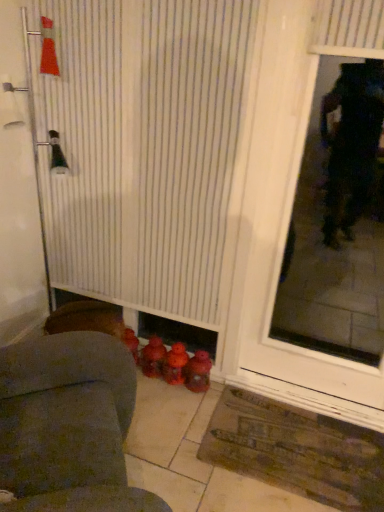
Question: Is transparent glass door at right closer to camera compared to rubberized red toy at lower center, which appears as the 3th toy when viewed from the left?

Choices:
 (A) yes
 (B) no

Answer: (A)

Question: Considering the relative sizes of transparent glass door at right and rubberized red toy at lower center, which appears as the 3th toy when viewed from the left, in the image provided, is transparent glass door at right smaller than rubberized red toy at lower center, which appears as the 3th toy when viewed from the left,?

Choices:
 (A) no
 (B) yes

Answer: (A)

Question: Is transparent glass door at right not inside rubberized red toy at lower center, the first toy positioned from the right?

Choices:
 (A) yes
 (B) no

Answer: (A)

Question: From a real-world perspective, is transparent glass door at right under rubberized red toy at lower center, the first toy positioned from the right?

Choices:
 (A) no
 (B) yes

Answer: (A)

Question: Would you consider transparent glass door at right to be distant from rubberized red toy at lower center, which appears as the 3th toy when viewed from the left?

Choices:
 (A) yes
 (B) no

Answer: (A)

Question: Is the depth of transparent glass door at right greater than that of rubberized red toy at lower center, the first toy positioned from the right?

Choices:
 (A) no
 (B) yes

Answer: (A)

Question: Does white textured door at left have a lesser width compared to brown textured mat at lower right?

Choices:
 (A) yes
 (B) no

Answer: (A)

Question: Considering the relative positions of white textured door at left and brown textured mat at lower right in the image provided, is white textured door at left behind brown textured mat at lower right?

Choices:
 (A) yes
 (B) no

Answer: (B)

Question: Is brown textured mat at lower right located within white textured door at left?

Choices:
 (A) yes
 (B) no

Answer: (B)

Question: Is white textured door at left taller than brown textured mat at lower right?

Choices:
 (A) yes
 (B) no

Answer: (A)

Question: From a real-world perspective, is white textured door at left beneath brown textured mat at lower right?

Choices:
 (A) no
 (B) yes

Answer: (A)

Question: From the image's perspective, is white textured door at left located above brown textured mat at lower right?

Choices:
 (A) yes
 (B) no

Answer: (A)

Question: Is rubberized plastic toy at lower center, the 2th toy when ordered from left to right, not near rubberized red toy at lower center, the first toy positioned from the right?

Choices:
 (A) yes
 (B) no

Answer: (B)